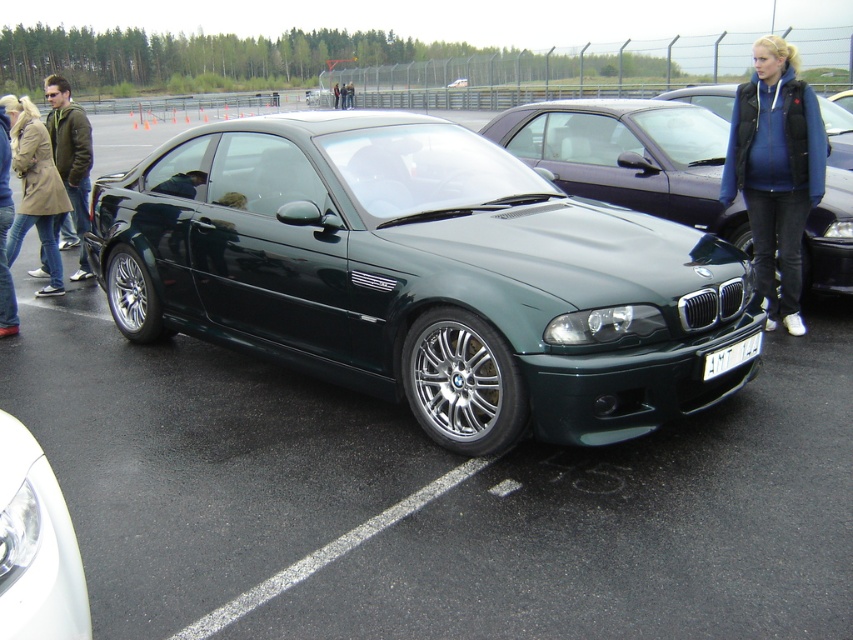
Does green metallic car at center have a lesser width compared to white glossy headlight at lower left?

In fact, green metallic car at center might be wider than white glossy headlight at lower left.

Is green metallic car at center above white glossy headlight at lower left?

Yes.

Is point (666, 156) farther from camera compared to point (7, 486)?

That is True.

This screenshot has height=640, width=853. I want to click on green metallic car at center, so click(630, 156).

Between point (9, 209) and point (308, 100), which one is positioned in front?

Point (9, 209)

Who is positioned more to the right, jeans at left or metallic green car at center?

From the viewer's perspective, jeans at left appears more on the right side.

Who is more forward, (1, 225) or (331, 99)?

Point (1, 225) is in front.

I want to click on jeans at left, so click(4, 234).

Can you confirm if tan leather coat at left is positioned to the left of jeans at left?

Yes, tan leather coat at left is to the left of jeans at left.

Can you confirm if tan leather coat at left is positioned below jeans at left?

No.

Is point (30, 141) closer to viewer compared to point (4, 230)?

No, (30, 141) is further to viewer.

At what (x,y) coordinates should I click in order to perform the action: click on tan leather coat at left. Please return your answer as a coordinate pair (x, y). Image resolution: width=853 pixels, height=640 pixels. Looking at the image, I should click on (33, 188).